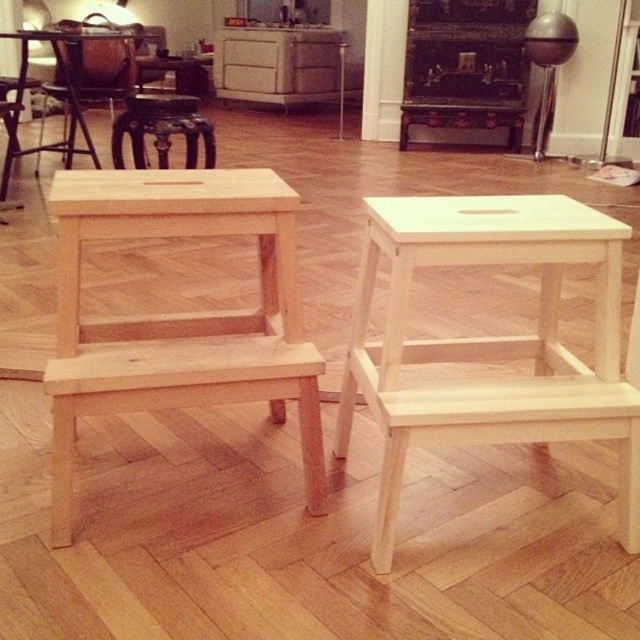
Question: Can you confirm if natural wood step stool at center is positioned above wooden stool at left?

Choices:
 (A) no
 (B) yes

Answer: (A)

Question: Which point appears farthest from the camera in this image?

Choices:
 (A) (132, 196)
 (B) (205, 150)

Answer: (B)

Question: Which of the following is the closest to the observer?

Choices:
 (A) (29, 148)
 (B) (131, 120)

Answer: (B)

Question: Where is natural wood step stool at center located in relation to dark brown leather bar stool at center in the image?

Choices:
 (A) right
 (B) left

Answer: (A)

Question: Does natural wood step stool at left have a smaller size compared to dark brown leather bar stool at center?

Choices:
 (A) no
 (B) yes

Answer: (A)

Question: Which of the following is the farthest from the observer?

Choices:
 (A) (188, 125)
 (B) (104, 211)
 (C) (147, 64)
 (D) (81, 148)

Answer: (C)